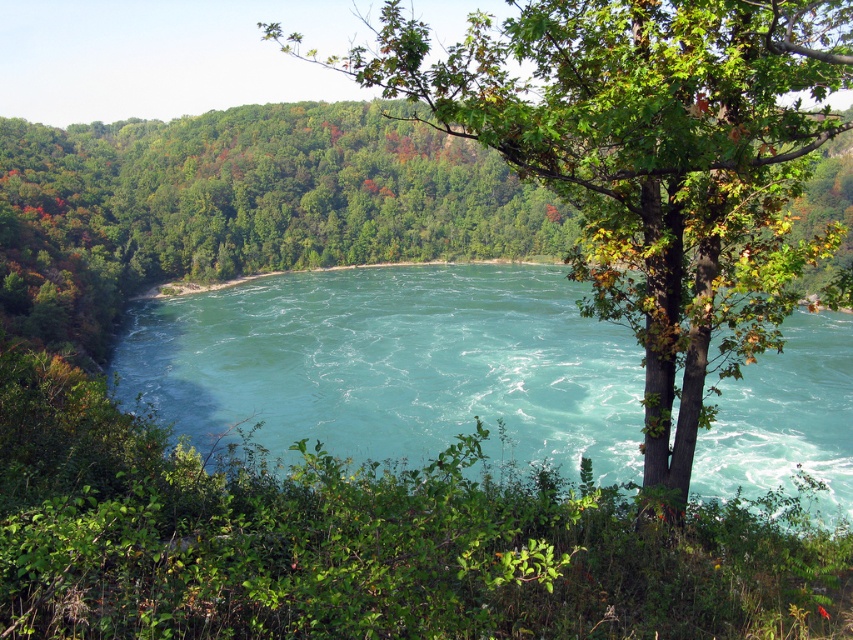
Between green leafy tree at center and turquoise water at center, which one is positioned higher?

Positioned higher is green leafy tree at center.

Which is more to the left, green leafy tree at center or turquoise water at center?

Positioned to the left is turquoise water at center.

Is point (650, 83) behind point (511, 300)?

No, it is in front of (511, 300).

Locate an element on the screen. This screenshot has height=640, width=853. green leafy tree at center is located at coordinates (651, 163).